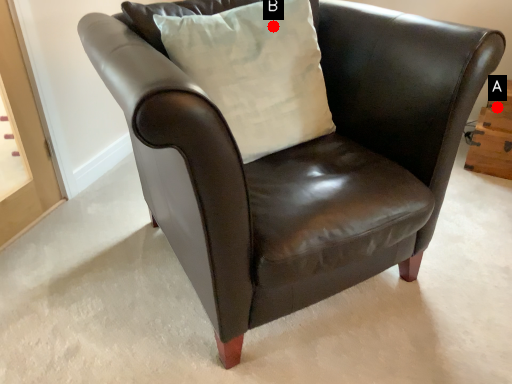
Question: Two points are circled on the image, labeled by A and B beside each circle. Which of the following is the closest to the observer?

Choices:
 (A) A is closer
 (B) B is closer

Answer: (B)